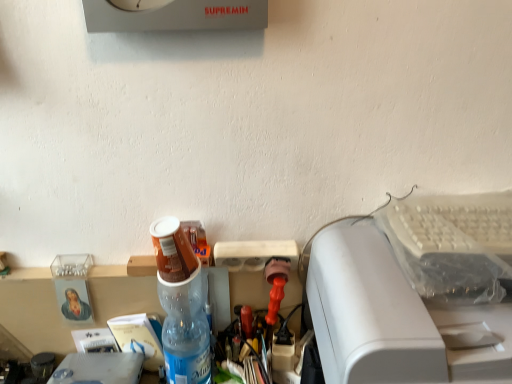
Where is `translucent plastic bottle at center`? The width and height of the screenshot is (512, 384). translucent plastic bottle at center is located at coordinates [181, 305].

What do you see at coordinates (181, 305) in the screenshot? The image size is (512, 384). I see `translucent plastic bottle at center` at bounding box center [181, 305].

Identify the location of white plastic printer at right. (399, 303).

The image size is (512, 384). Describe the element at coordinates (399, 303) in the screenshot. I see `white plastic printer at right` at that location.

Identify the location of translucent plastic bottle at center. (181, 305).

Considering the relative positions of white plastic printer at right and translucent plastic bottle at center in the image provided, is white plastic printer at right to the left or to the right of translucent plastic bottle at center?

Based on their positions, white plastic printer at right is located to the right of translucent plastic bottle at center.

Who is more distant, white plastic printer at right or translucent plastic bottle at center?

translucent plastic bottle at center is behind.

Which is closer, (326,273) or (161,293)?

Point (326,273)

From the image's perspective, is white plastic printer at right under translucent plastic bottle at center?

Correct, white plastic printer at right appears lower than translucent plastic bottle at center in the image.

From a real-world perspective, is white plastic printer at right over translucent plastic bottle at center?

Yes.

Which of these two, white plastic printer at right or translucent plastic bottle at center, is wider?

white plastic printer at right.

Is white plastic printer at right taller or shorter than translucent plastic bottle at center?

Considering their sizes, white plastic printer at right has more height than translucent plastic bottle at center.

Looking at this image, between white plastic printer at right and translucent plastic bottle at center, which one has smaller size?

translucent plastic bottle at center.

Is white plastic printer at right not within translucent plastic bottle at center?

That's correct, white plastic printer at right is outside of translucent plastic bottle at center.

Does white plastic printer at right touch translucent plastic bottle at center?

No, white plastic printer at right is not in contact with translucent plastic bottle at center.

Is white plastic printer at right positioned with its back to translucent plastic bottle at center?

No, white plastic printer at right's orientation is not away from translucent plastic bottle at center.

How different are the orientations of white plastic printer at right and translucent plastic bottle at center in degrees?

The angular difference between white plastic printer at right and translucent plastic bottle at center is 3.13 degrees.

How distant is white plastic printer at right from translucent plastic bottle at center?

white plastic printer at right and translucent plastic bottle at center are 12.09 inches apart.

Identify the location of printer above the translucent plastic bottle at center (from a real-world perspective). The height and width of the screenshot is (384, 512). (399, 303).

Considering the relative positions of translucent plastic bottle at center and white plastic printer at right in the image provided, is translucent plastic bottle at center to the left or to the right of white plastic printer at right?

Clearly, translucent plastic bottle at center is on the left of white plastic printer at right in the image.

Is the position of translucent plastic bottle at center more distant than that of white plastic printer at right?

Yes, translucent plastic bottle at center is further from the camera.

Considering the positions of points (167, 329) and (391, 263), is point (167, 329) closer to camera compared to point (391, 263)?

No.

From the image's perspective, which is above, translucent plastic bottle at center or white plastic printer at right?

translucent plastic bottle at center.

From a real-world perspective, relative to white plastic printer at right, is translucent plastic bottle at center vertically above or below?

In terms of real-world spatial position, translucent plastic bottle at center is below white plastic printer at right.

Consider the image. Does translucent plastic bottle at center have a lesser width compared to white plastic printer at right?

Correct, the width of translucent plastic bottle at center is less than that of white plastic printer at right.

Does translucent plastic bottle at center have a greater height compared to white plastic printer at right?

Incorrect, the height of translucent plastic bottle at center is not larger of that of white plastic printer at right.

Looking at this image, which of these two, translucent plastic bottle at center or white plastic printer at right, is smaller?

Smaller between the two is translucent plastic bottle at center.

Would you say white plastic printer at right is part of translucent plastic bottle at center's contents?

No, white plastic printer at right is not inside translucent plastic bottle at center.

Would you consider translucent plastic bottle at center to be distant from white plastic printer at right?

No, translucent plastic bottle at center is not far away from white plastic printer at right.

Is translucent plastic bottle at center looking in the opposite direction of white plastic printer at right?

That's not correct — translucent plastic bottle at center is not looking away from white plastic printer at right.

How different are the orientations of translucent plastic bottle at center and white plastic printer at right in degrees?

The facing directions of translucent plastic bottle at center and white plastic printer at right are 3.13 degrees apart.

Identify the location of bottle below the white plastic printer at right (from a real-world perspective). The height and width of the screenshot is (384, 512). (181, 305).

Where is `printer above the translucent plastic bottle at center (from a real-world perspective)`? The image size is (512, 384). printer above the translucent plastic bottle at center (from a real-world perspective) is located at coordinates (399, 303).

This screenshot has height=384, width=512. Find the location of `bottle behind the white plastic printer at right`. bottle behind the white plastic printer at right is located at coordinates [181, 305].